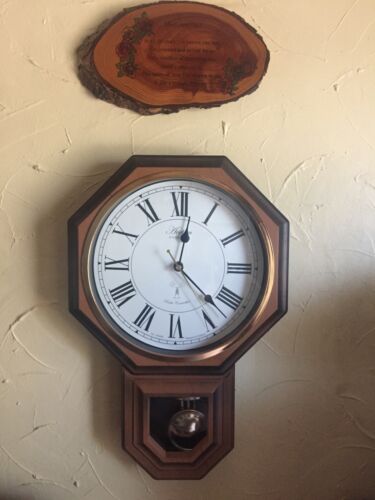
The height and width of the screenshot is (500, 375). I want to click on bottom of clock, so click(189, 464).